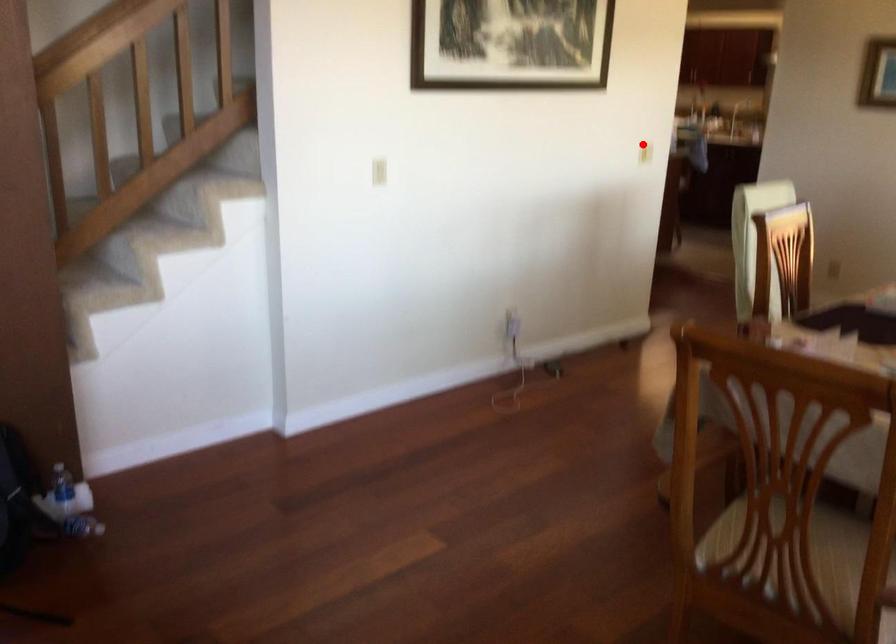
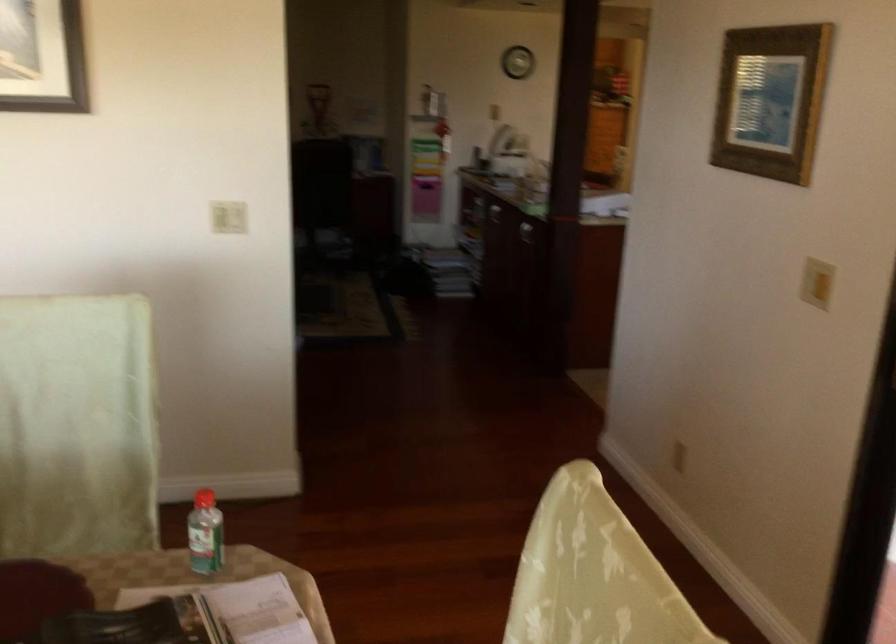
Where in the second image is the point corresponding to the highlighted location from the first image?

(228, 216)